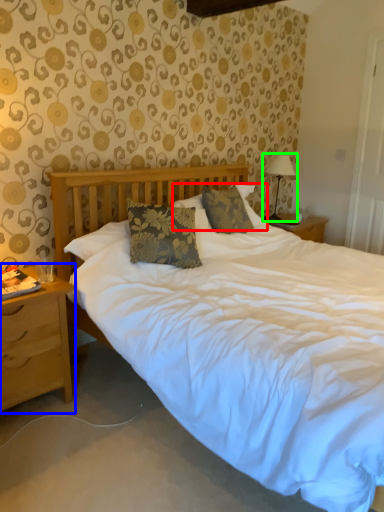
Question: Which object is the farthest from pillow (highlighted by a red box)? Choose among these: nightstand (highlighted by a blue box) or table lamp (highlighted by a green box).

Choices:
 (A) nightstand
 (B) table lamp

Answer: (A)